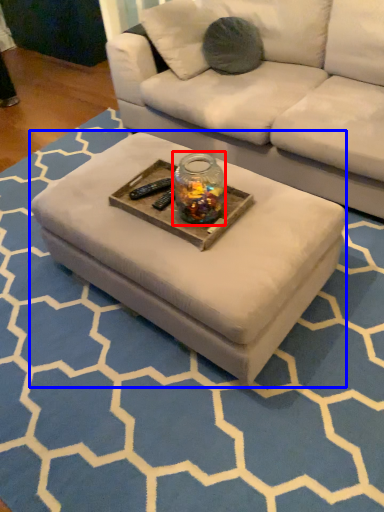
Question: Which of the following is the farthest to the observer, glass jar (highlighted by a red box) or coffee table (highlighted by a blue box)?

Choices:
 (A) glass jar
 (B) coffee table

Answer: (A)